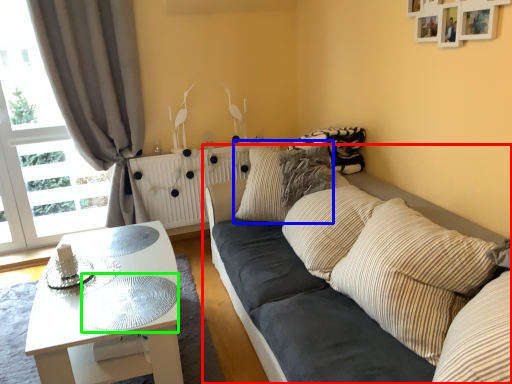
Question: Based on their relative distances, which object is nearer to studio couch (highlighted by a red box)? Choose from pillow (highlighted by a blue box) and glass table (highlighted by a green box).

Choices:
 (A) pillow
 (B) glass table

Answer: (A)